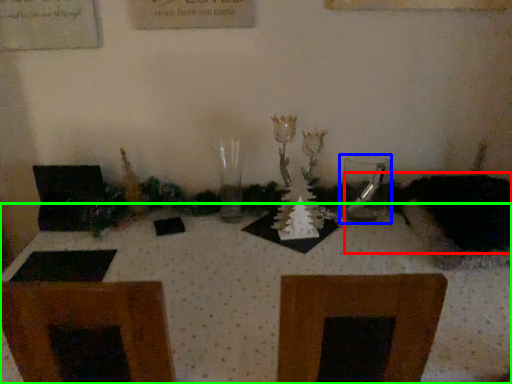
Question: Which object is the closest to the animal (highlighted by a red box)? Choose among these: tableware (highlighted by a blue box) or table (highlighted by a green box).

Choices:
 (A) tableware
 (B) table

Answer: (A)